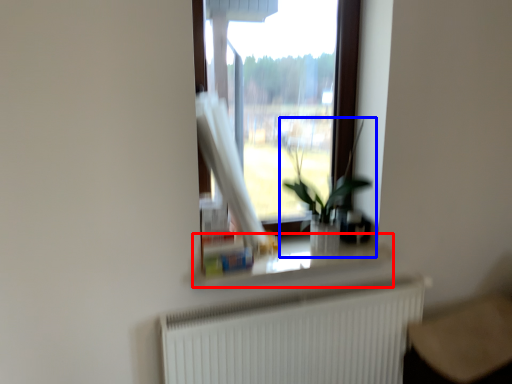
Question: Among these objects, which one is farthest to the camera, window sill (highlighted by a red box) or houseplant (highlighted by a blue box)?

Choices:
 (A) window sill
 (B) houseplant

Answer: (A)